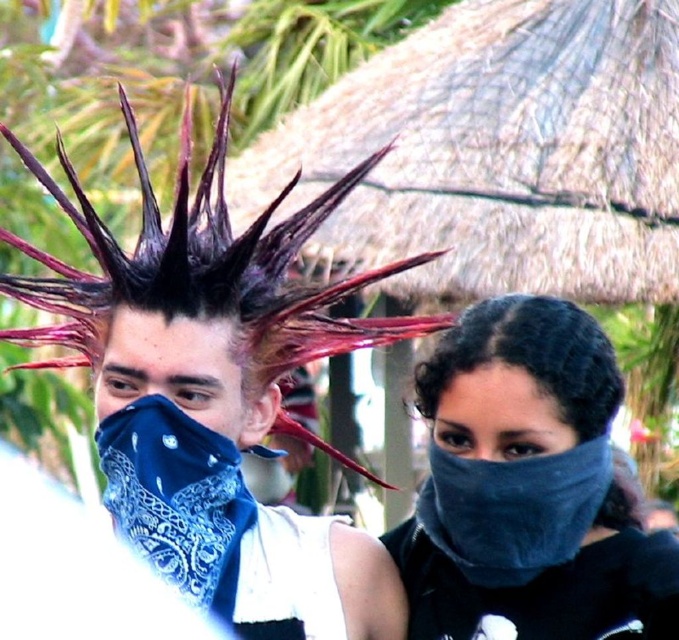
Is shiny dark hair at center wider than dark curly hair at center?

Correct, the width of shiny dark hair at center exceeds that of dark curly hair at center.

Between shiny dark hair at center and dark curly hair at center, which one has more height?

Standing taller between the two is shiny dark hair at center.

Describe the element at coordinates (196, 349) in the screenshot. I see `shiny dark hair at center` at that location.

Where is `shiny dark hair at center`? The height and width of the screenshot is (640, 679). shiny dark hair at center is located at coordinates (196, 349).

Who is taller, dark curly hair at center or blue bandana at center?

blue bandana at center

Can you confirm if dark curly hair at center is shorter than blue bandana at center?

Indeed, dark curly hair at center has a lesser height compared to blue bandana at center.

The height and width of the screenshot is (640, 679). Describe the element at coordinates (530, 355) in the screenshot. I see `dark curly hair at center` at that location.

Identify the location of dark curly hair at center. The width and height of the screenshot is (679, 640). (530, 355).

Is velvet dark blue scarf at center wider than blue bandana at center?

Result: Correct, the width of velvet dark blue scarf at center exceeds that of blue bandana at center.

Is point (629, 627) behind point (244, 432)?

No.

Does point (559, 468) come behind point (210, 332)?

No, (559, 468) is in front of (210, 332).

You are a GUI agent. You are given a task and a screenshot of the screen. Output one action in this format:
    pyautogui.click(x=<x>, y=<y>)
    Task: Click on the velvet dark blue scarf at center
    This screenshot has width=679, height=640.
    Given the screenshot: What is the action you would take?
    pyautogui.click(x=528, y=488)